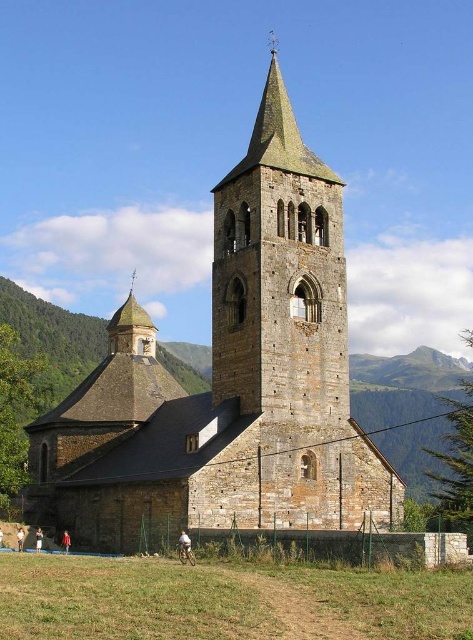
This screenshot has height=640, width=473. What do you see at coordinates (231, 381) in the screenshot?
I see `brown stone church at center` at bounding box center [231, 381].

Is point (131, 493) closer to camera compared to point (134, 300)?

That is True.

You are a GUI agent. You are given a task and a screenshot of the screen. Output one action in this format:
    pyautogui.click(x=<x>, y=<y>)
    Task: Click on the brown stone church at center
    
    Given the screenshot: What is the action you would take?
    pyautogui.click(x=231, y=381)